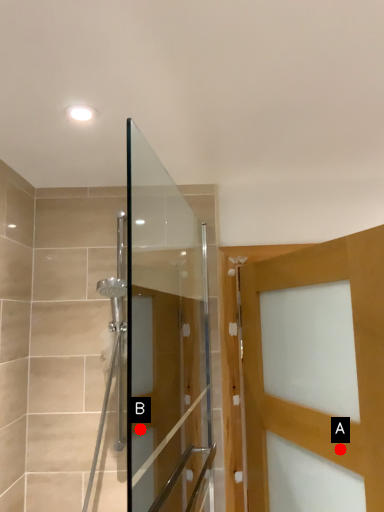
Question: Two points are circled on the image, labeled by A and B beside each circle. Which point is closer to the camera?

Choices:
 (A) A is closer
 (B) B is closer

Answer: (A)